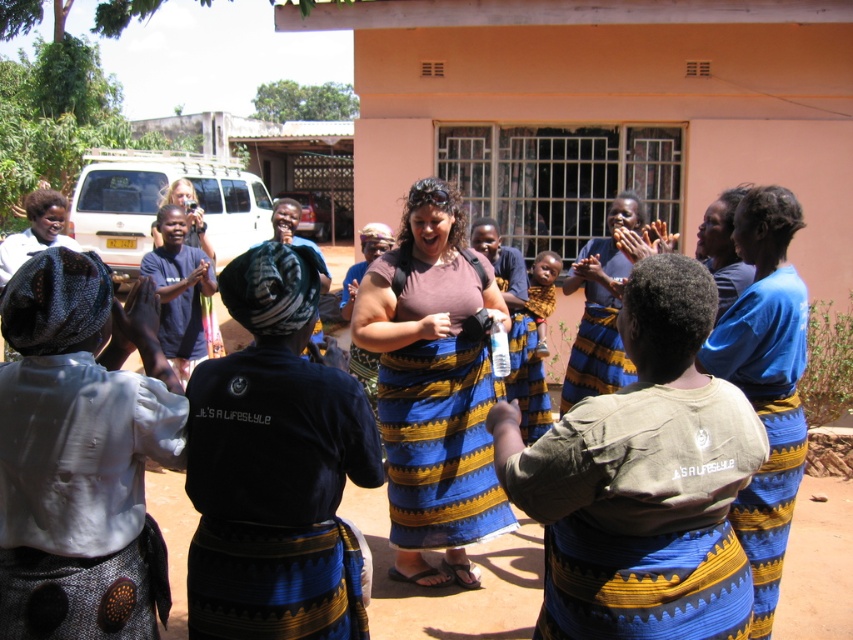
Which is below, blue woven fabric dress at center or matte brown shirt at center?

blue woven fabric dress at center

Which is more to the right, blue woven fabric dress at center or matte brown shirt at center?

matte brown shirt at center is more to the right.

The height and width of the screenshot is (640, 853). In order to click on blue woven fabric dress at center in this screenshot , I will do `click(276, 467)`.

This screenshot has height=640, width=853. I want to click on blue woven fabric dress at center, so coord(276,467).

Can you confirm if white cotton shirt at center is wider than blue woven fabric dress at center?

Incorrect, white cotton shirt at center's width does not surpass blue woven fabric dress at center's.

Between point (154, 426) and point (289, 564), which one is positioned in front?

Point (154, 426) is in front.

Who is more forward, (90, 513) or (238, 268)?

Point (90, 513)

This screenshot has height=640, width=853. I want to click on white cotton shirt at center, so click(x=79, y=458).

This screenshot has height=640, width=853. What do you see at coordinates (79, 458) in the screenshot? I see `white cotton shirt at center` at bounding box center [79, 458].

Can you confirm if white cotton shirt at center is smaller than blue striped dress at center?

Indeed, white cotton shirt at center has a smaller size compared to blue striped dress at center.

Does point (26, 404) come behind point (612, 314)?

No, it is in front of (612, 314).

The width and height of the screenshot is (853, 640). I want to click on white cotton shirt at center, so click(79, 458).